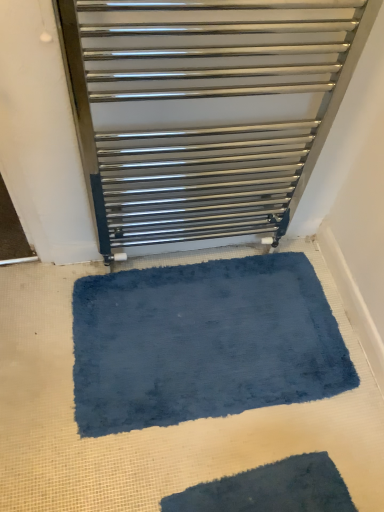
The width and height of the screenshot is (384, 512). I want to click on free spot below satin silver towel rail at upper center (from a real-world perspective), so click(x=188, y=254).